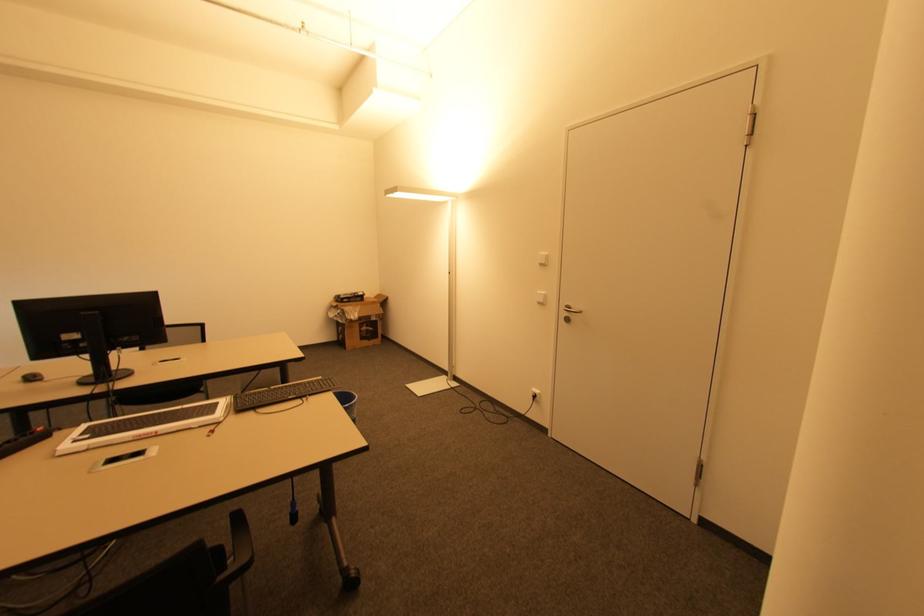
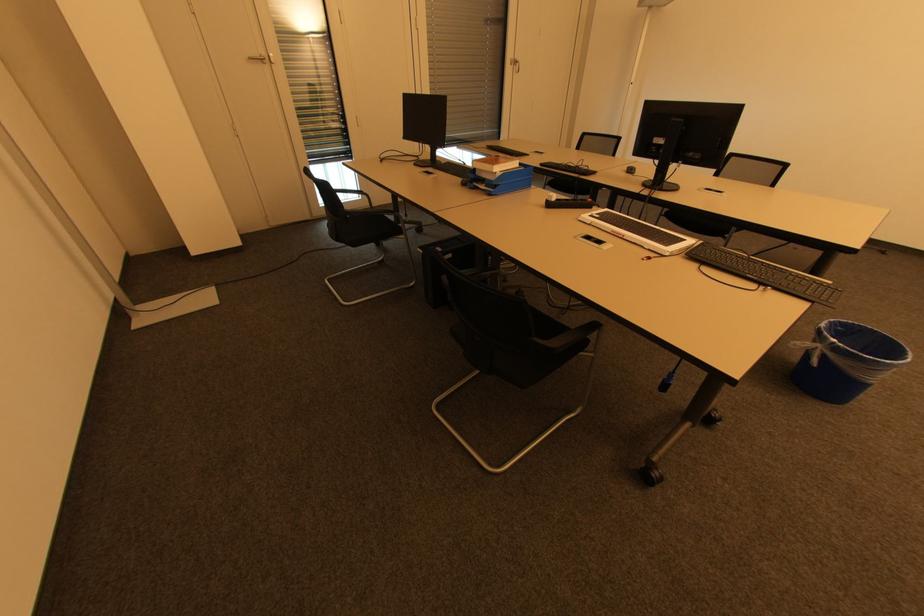
In the second image, find the point that corresponds to (x=42, y=381) in the first image.

(634, 174)